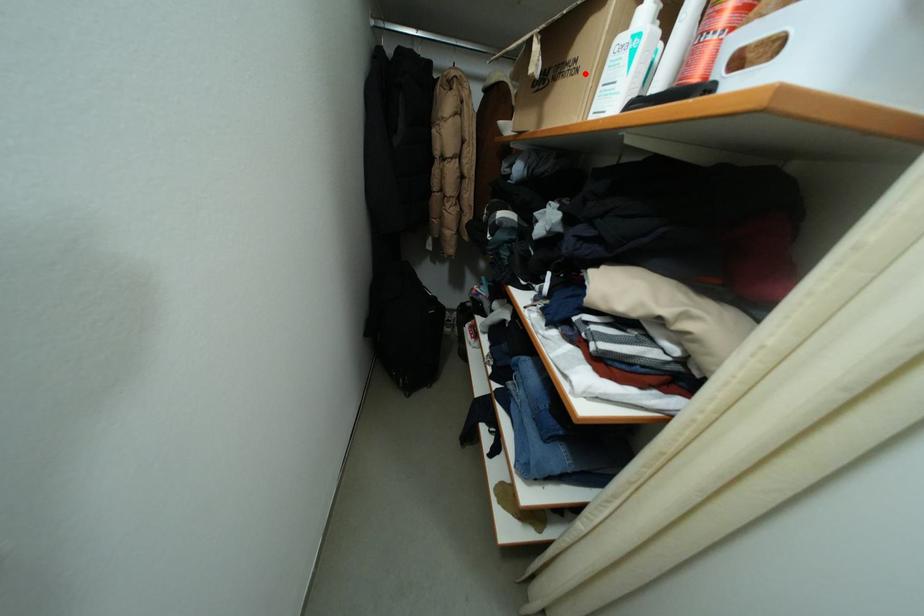
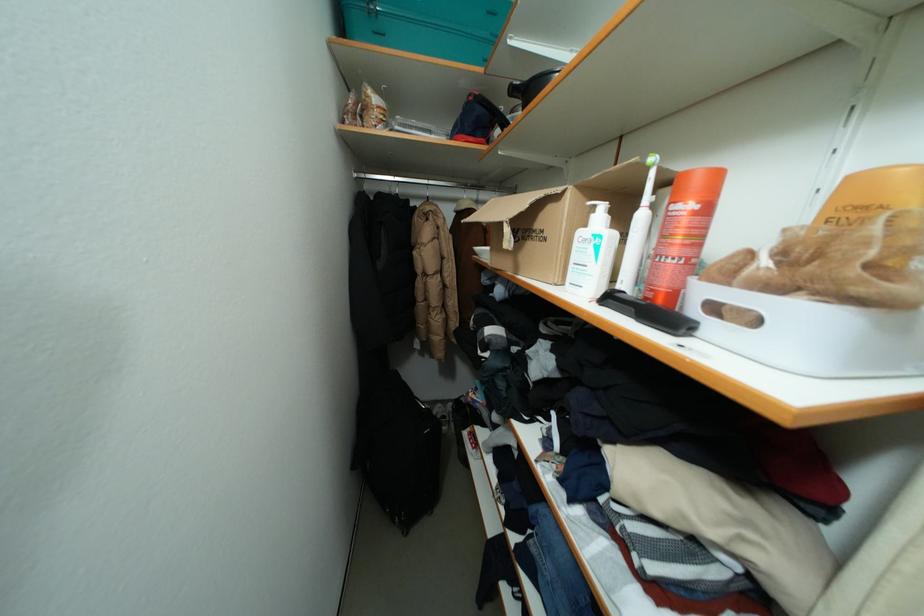
Question: I am providing you with two images of the same scene from different viewpoints. A red point is marked on the first image. Can you still see the location of the red point in image 2?

Choices:
 (A) Yes
 (B) No

Answer: (A)